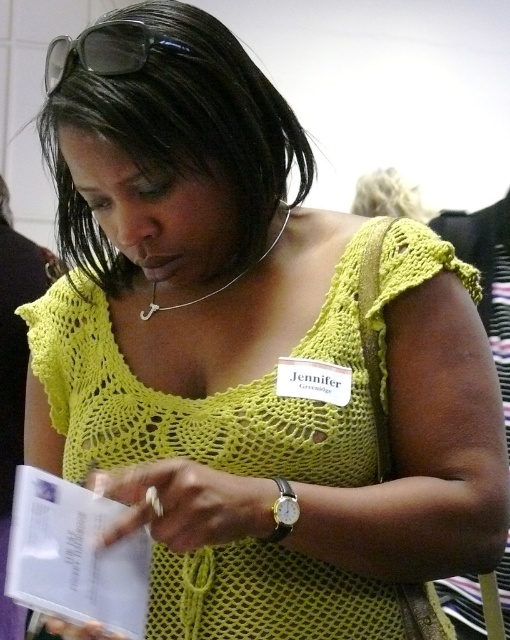
You are a student attending a workshop and need to read the instructions on the white paper book at lower left and the clear plastic goggles at upper center. Since you can only focus on one object at a time, which one should you look at first to ensure you don not have to move your head much?

The white paper book at lower left is in front of the clear plastic goggles at upper center, so you should look at the white paper book at lower left first because it is closer to you and requires less head movement.

You are organizing a workshop and need to place the white paper book at lower left and the clear plastic goggles at upper center on a shelf. If the shelf has limited space, which item should you place first to ensure both fit?

The white paper book at lower left has a lesser width compared to the clear plastic goggles at upper center. Therefore, you should place the clear plastic goggles at upper center first to accommodate its larger width, then the white paper book at lower left will fit alongside it.